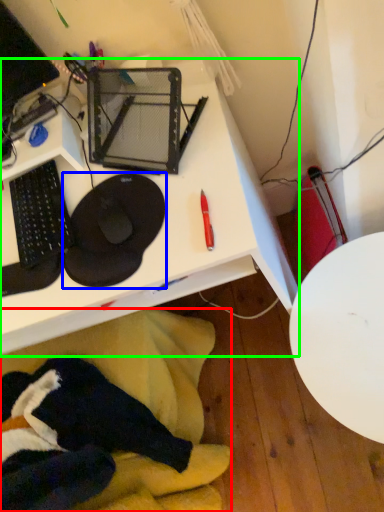
Question: Which object is positioned closest to swivel chair (highlighted by a red box)? Select from sit (highlighted by a blue box) and desk (highlighted by a green box).

Choices:
 (A) sit
 (B) desk

Answer: (B)